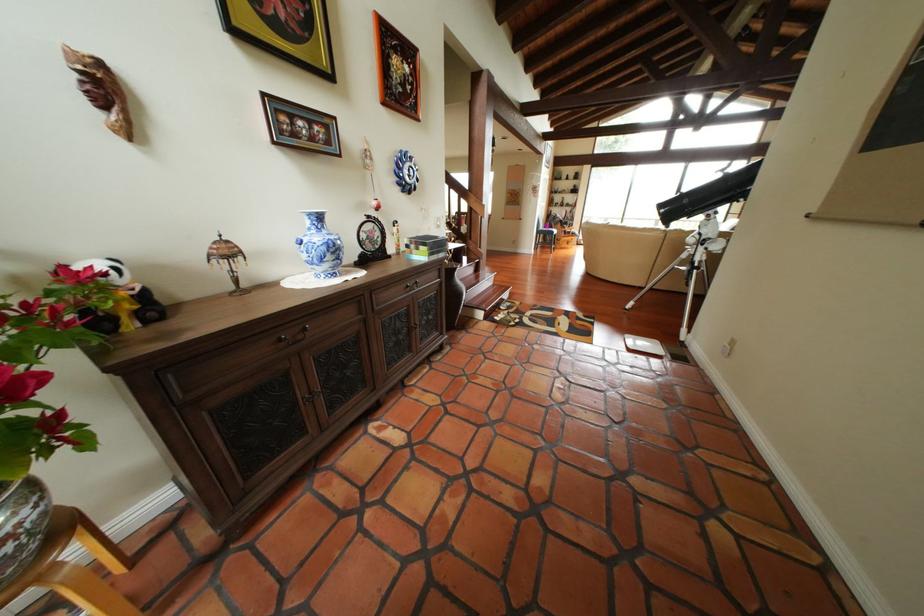
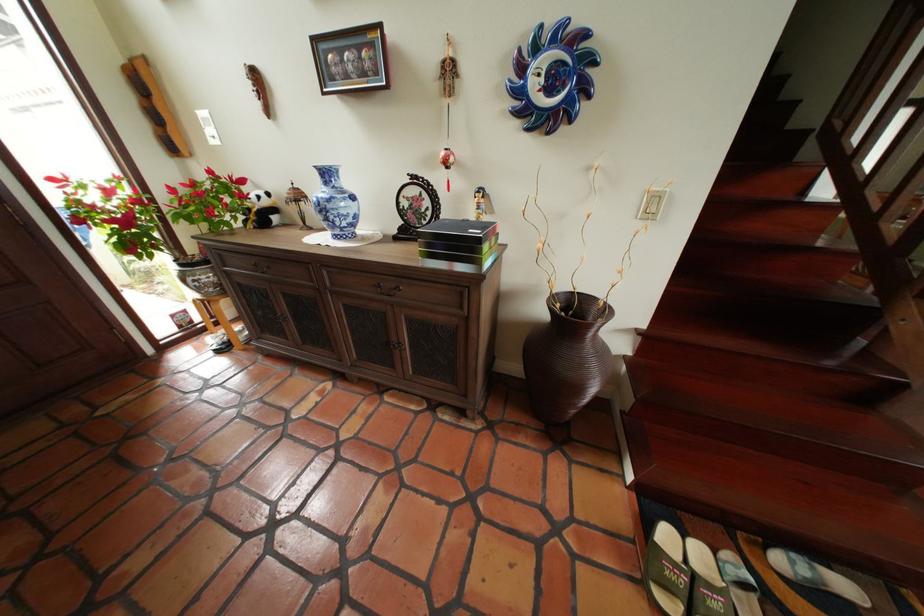
In the second image, find the point that corresponds to point (516, 307) in the first image.

(806, 564)